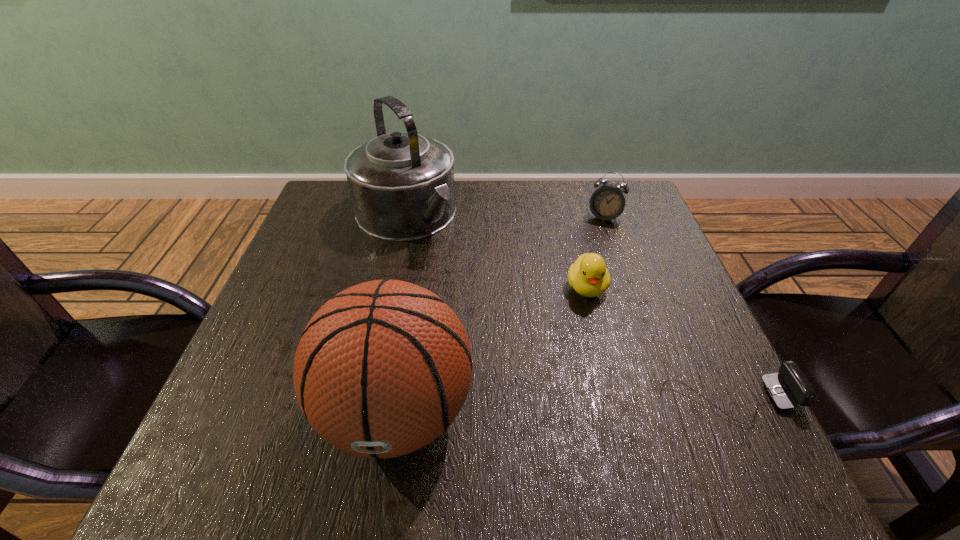
The height and width of the screenshot is (540, 960). In order to click on basketball in this screenshot , I will do `click(382, 369)`.

The width and height of the screenshot is (960, 540). In order to click on webcam in this screenshot , I will do `click(791, 387)`.

Locate an element on the screen. This screenshot has width=960, height=540. kettle is located at coordinates tap(402, 188).

Find the location of `alarm clock`. alarm clock is located at coordinates (608, 201).

Where is `the third nearest object`? The height and width of the screenshot is (540, 960). the third nearest object is located at coordinates (588, 275).

This screenshot has width=960, height=540. Identify the location of duckling. (588, 275).

At what (x,y) coordinates should I click in order to perform the action: click on vacant space situated 0.140m with the spout at the front of the kettle. Please return your answer as a coordinate pair (x, y). The height and width of the screenshot is (540, 960). Looking at the image, I should click on (465, 276).

Find the location of a particular element. This screenshot has width=960, height=540. free space located 0.360m with the spout at the front of the kettle is located at coordinates (529, 338).

Find the location of a particular element. The width and height of the screenshot is (960, 540). vacant region located 0.080m with the spout at the front of the kettle is located at coordinates (450, 262).

Locate an element on the screen. Image resolution: width=960 pixels, height=540 pixels. free space located on the face of the alarm clock is located at coordinates (594, 245).